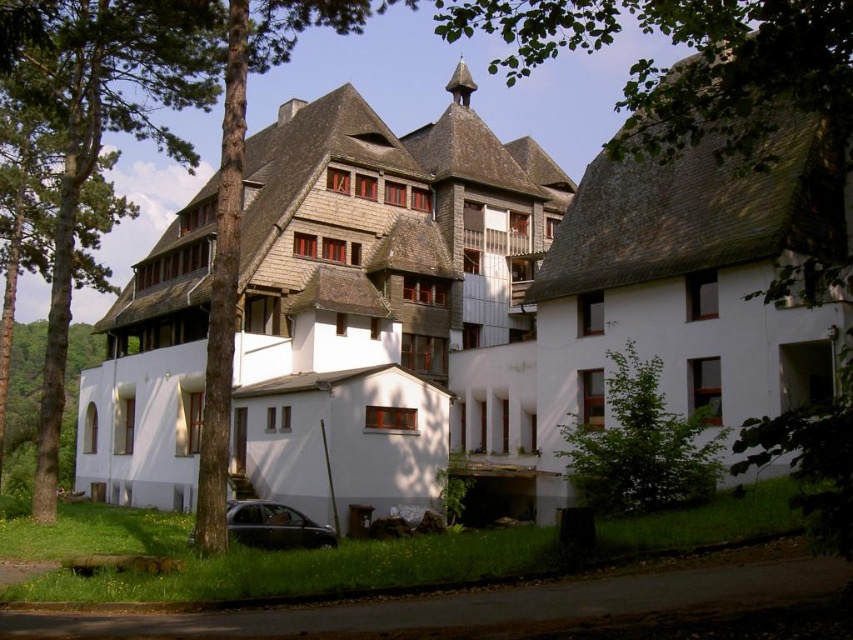
You are an architect planning to add a new tree to the building facade. Given the existing green leafy tree at upper center and the green leafy tree at left, which tree should you consider as a reference for size to ensure the new tree fits appropriately?

The green leafy tree at upper center is larger in size than the green leafy tree at left, so you should use the green leafy tree at upper center as a reference to ensure the new tree is appropriately sized.

You are standing at the base of the green leafy tree at left and want to take a photo of the multi story building with your camera. The camera has a maximum zoom range of 50 meters. Can you capture the building in your photo without moving from your current position?

The green leafy tree at left and camera are 59.10 meters apart from each other, which exceeds the camera maximum zoom range of 50 meters. So you cannot capture the building in your photo without moving from your current position.

You are standing 100 feet away from the building. Can you see the green leafy tree at upper center from your current position?

The green leafy tree at upper center is 117.44 feet away from the viewer. Since you are standing 100 feet away from the building, you are closer than the tree, so the tree is behind the building and not visible from your current position.